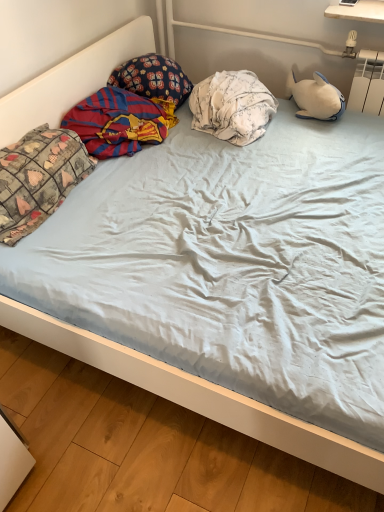
Question: Looking at the image, does patchwork fabric pillow at left, which is counted as the third pillow, starting from the right, seem bigger or smaller compared to dark blue floral pillow at upper left, placed as the 2th pillow when sorted from left to right?

Choices:
 (A) small
 (B) big

Answer: (B)

Question: In the image, is patchwork fabric pillow at left, which is counted as the third pillow, starting from the right, positioned in front of or behind dark blue floral pillow at upper left, placed as the 2th pillow when sorted from left to right?

Choices:
 (A) front
 (B) behind

Answer: (A)

Question: Estimate the real-world distances between objects in this image. Which object is farther from the patchwork fabric pillow at left, the first pillow from the left?

Choices:
 (A) dark blue floral pillow at upper left, which ranks as the 2th pillow in right-to-left order
 (B) red and blue striped fabric at left
 (C) white floral fabric pillow at center, acting as the 3th pillow starting from the left

Answer: (C)

Question: Considering the real-world distances, which object is closest to the patchwork fabric pillow at left, the first pillow from the left?

Choices:
 (A) dark blue floral pillow at upper left, placed as the 2th pillow when sorted from left to right
 (B) white floral fabric pillow at center, acting as the 3th pillow starting from the left
 (C) red and blue striped fabric at left

Answer: (C)